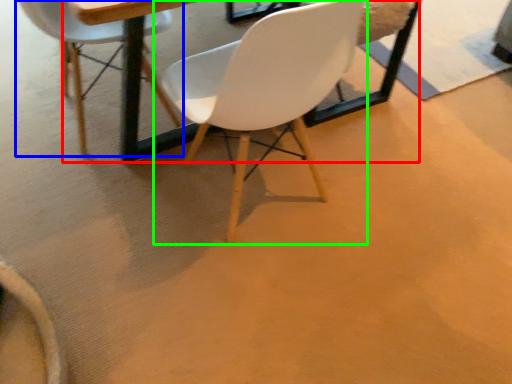
Question: Based on their relative distances, which object is farther from round table (highlighted by a red box)? Choose from chair (highlighted by a blue box) and chair (highlighted by a green box).

Choices:
 (A) chair
 (B) chair

Answer: (B)